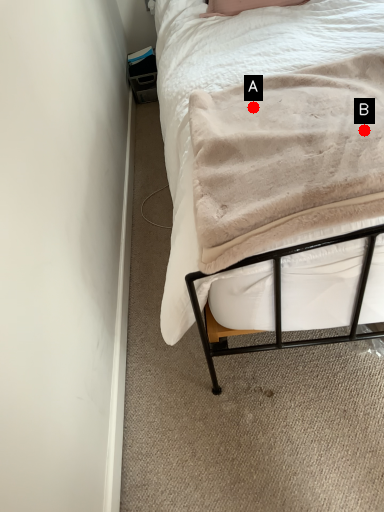
Question: Two points are circled on the image, labeled by A and B beside each circle. Which point appears closest to the camera in this image?

Choices:
 (A) A is closer
 (B) B is closer

Answer: (B)